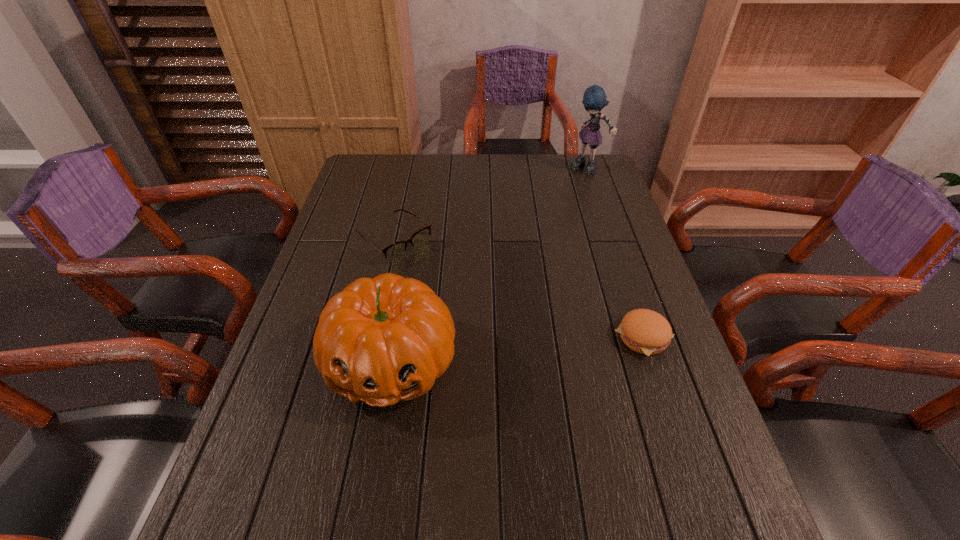
This screenshot has width=960, height=540. Find the location of `the second tallest object`. the second tallest object is located at coordinates (384, 339).

You are a GUI agent. You are given a task and a screenshot of the screen. Output one action in this format:
    pyautogui.click(x=<x>, y=<y>)
    Task: Click on the patty
    The image size is (960, 540).
    Given the screenshot: What is the action you would take?
    pyautogui.click(x=647, y=332)

The height and width of the screenshot is (540, 960). I want to click on the second farthest object, so click(x=395, y=251).

You are a GUI agent. You are given a task and a screenshot of the screen. Output one action in this format:
    pyautogui.click(x=<x>, y=<y>)
    Task: Click on the farthest object
    The image size is (960, 540).
    Given the screenshot: What is the action you would take?
    pyautogui.click(x=594, y=99)

Locate an element on the screen. the tallest object is located at coordinates (594, 99).

At what (x,y) coordinates should I click in order to perform the action: click on free space located 0.340m on the back of the patty. Please return your answer as a coordinate pair (x, y). This screenshot has height=540, width=960. Looking at the image, I should click on (608, 231).

Identify the location of vacant area situated 0.240m on the face of the spectacles. The height and width of the screenshot is (540, 960). (474, 305).

Locate an element on the screen. This screenshot has height=540, width=960. free space located on the face of the spectacles is located at coordinates (477, 307).

At what (x,y) coordinates should I click in order to perform the action: click on blank area located 0.400m on the face of the spectacles. Please return your answer as a coordinate pair (x, y). Looking at the image, I should click on (519, 342).

You are a GUI agent. You are given a task and a screenshot of the screen. Output one action in this format:
    pyautogui.click(x=<x>, y=<y>)
    Task: Click on the blank area located on the front-facing side of the tallest object
    This screenshot has height=540, width=960.
    Given the screenshot: What is the action you would take?
    pyautogui.click(x=555, y=234)